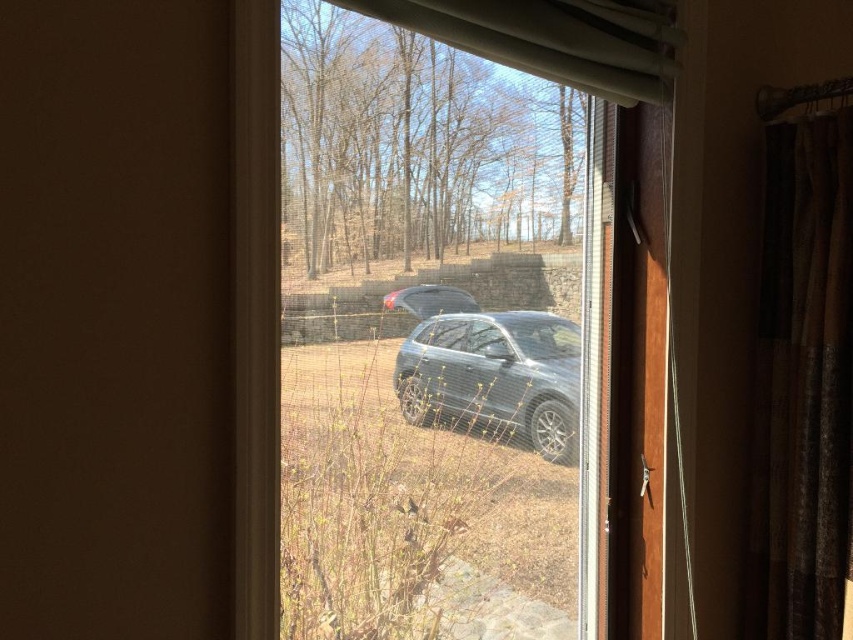
Between point (842, 509) and point (527, 388), which one is positioned behind?

The point (842, 509) is behind.

Which is more to the right, brown textured curtain at right or satin black suv at center?

brown textured curtain at right

Who is more distant from viewer, (749, 580) or (463, 419)?

The point (749, 580) is more distant.

Locate an element on the screen. brown textured curtain at right is located at coordinates (804, 381).

Does brown textured curtain at right have a smaller size compared to white sheer curtain at upper center?

Yes, brown textured curtain at right is smaller than white sheer curtain at upper center.

Who is more forward, (833, 166) or (611, 29)?

Positioned in front is point (611, 29).

Locate an element on the screen. brown textured curtain at right is located at coordinates (804, 381).

Between clear glass window at center and brown textured curtain at right, which one is positioned higher?

clear glass window at center is higher up.

Between clear glass window at center and brown textured curtain at right, which one has less height?

brown textured curtain at right

Is point (433, 496) less distant than point (834, 192)?

Yes, point (433, 496) is in front of point (834, 192).

Image resolution: width=853 pixels, height=640 pixels. What are the coordinates of `clear glass window at center` in the screenshot? It's located at (427, 310).